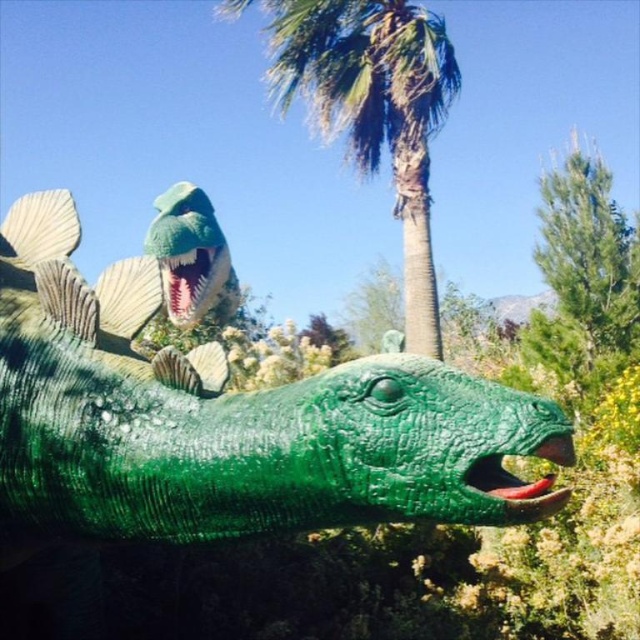
Does green glossy statue at center have a smaller size compared to green textured palm tree at upper center?

Indeed, green glossy statue at center has a smaller size compared to green textured palm tree at upper center.

Measure the distance between green glossy statue at center and camera.

green glossy statue at center is 4.95 feet from camera.

The width and height of the screenshot is (640, 640). Find the location of `green glossy statue at center`. green glossy statue at center is located at coordinates (228, 419).